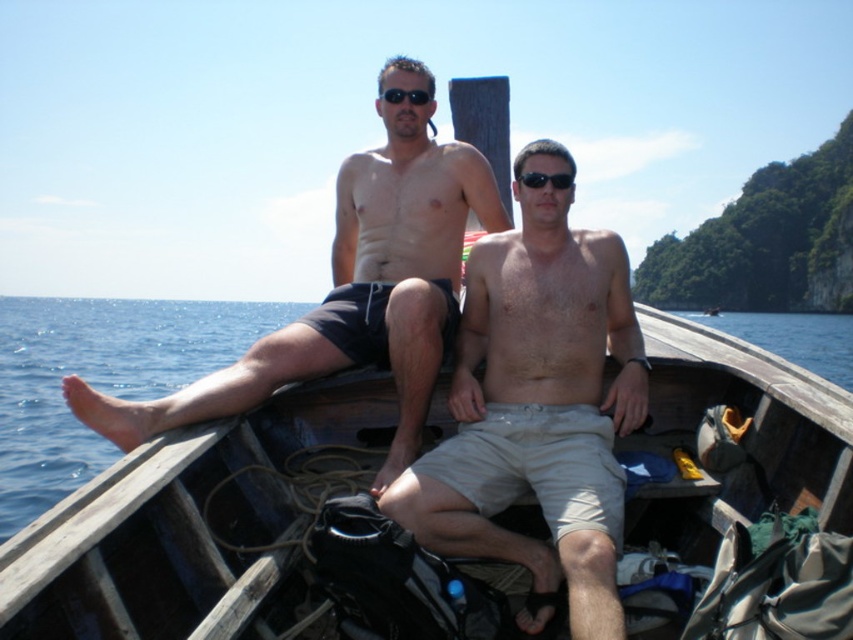
Is light beige shorts at center below black plastic sunglasses at center?

Yes.

Does light beige shorts at center have a greater height compared to black plastic sunglasses at center?

Indeed, light beige shorts at center has a greater height compared to black plastic sunglasses at center.

Is point (489, 298) closer to camera compared to point (561, 182)?

That is False.

At what (x,y) coordinates should I click in order to perform the action: click on light beige shorts at center. Please return your answer as a coordinate pair (x, y). Looking at the image, I should click on (537, 406).

Does wooden boat at center appear on the right side of black plastic sunglasses at center?

In fact, wooden boat at center is to the left of black plastic sunglasses at center.

Who is positioned more to the right, wooden boat at center or black plastic sunglasses at center?

From the viewer's perspective, black plastic sunglasses at center appears more on the right side.

The image size is (853, 640). Describe the element at coordinates (195, 524) in the screenshot. I see `wooden boat at center` at that location.

The image size is (853, 640). Find the location of `wooden boat at center`. wooden boat at center is located at coordinates (195, 524).

Between light beige shorts at center and black matte sunglasses at center, which one appears on the left side from the viewer's perspective?

black matte sunglasses at center

Is light beige shorts at center wider than black matte sunglasses at center?

Yes, light beige shorts at center is wider than black matte sunglasses at center.

Locate an element on the screen. Image resolution: width=853 pixels, height=640 pixels. light beige shorts at center is located at coordinates (537, 406).

Identify the location of light beige shorts at center. (537, 406).